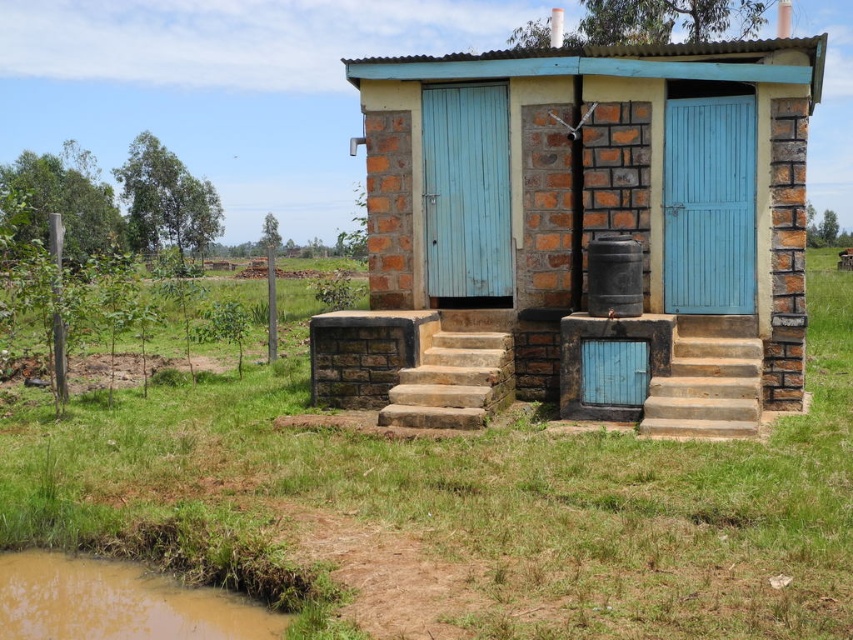
Question: Which point is closer to the camera taking this photo?

Choices:
 (A) (692, 244)
 (B) (636, 198)

Answer: (A)

Question: Which is nearer to the blue painted wood toilet at center?

Choices:
 (A) brown muddy puddle at lower left
 (B) green grass at center
 (C) brown stone stairs at center
 (D) blue painted wood door at right

Answer: (D)

Question: Does light blue wooden door at center have a smaller size compared to brown stone stairs at center?

Choices:
 (A) yes
 (B) no

Answer: (A)

Question: Based on their relative distances, which object is nearer to the blue painted wood toilet at center?

Choices:
 (A) brown stone stairs at right
 (B) brown stone stairs at center
 (C) blue painted wood door at right
 (D) light blue wooden door at center

Answer: (D)

Question: Can you confirm if brown muddy puddle at lower left is thinner than light blue wooden door at center?

Choices:
 (A) no
 (B) yes

Answer: (A)

Question: Can you confirm if blue painted wood toilet at center is wider than brown stone stairs at center?

Choices:
 (A) yes
 (B) no

Answer: (A)